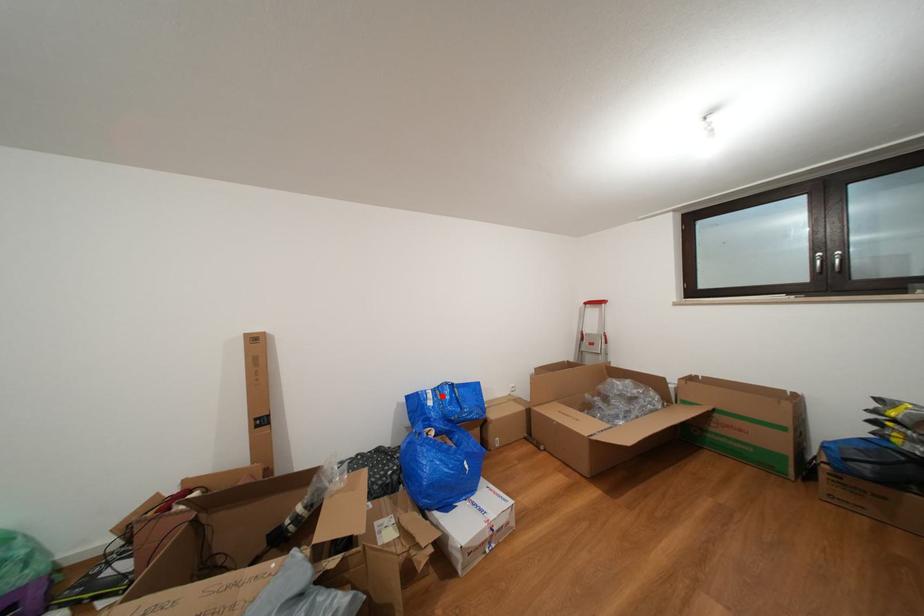
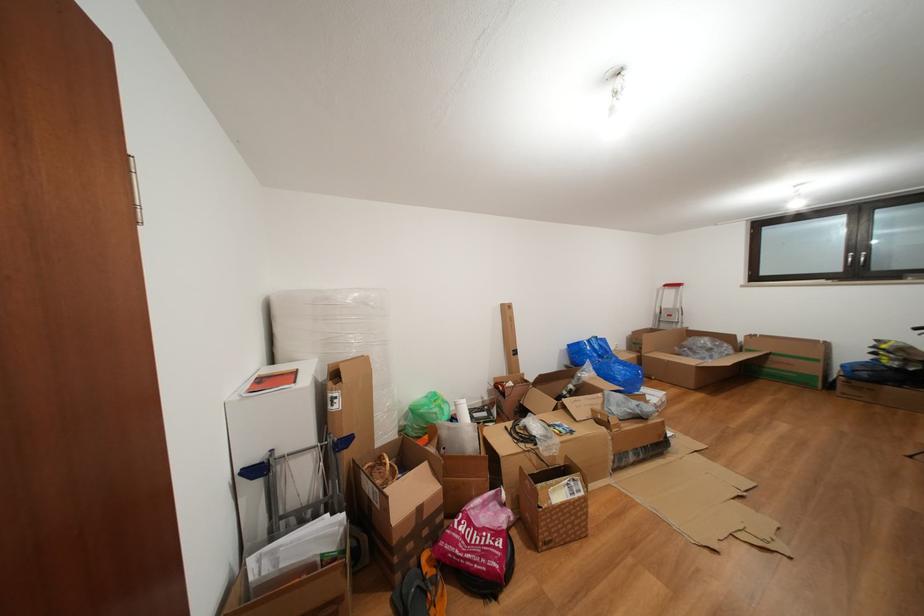
Find the pixel in the second image that matches the highlighted location in the first image.

(597, 346)